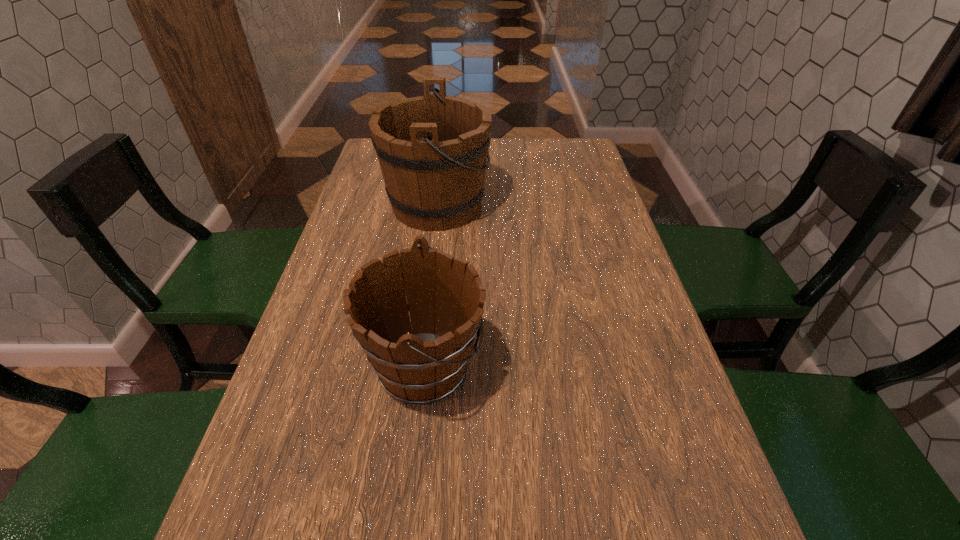
Find the location of a particular element. the taller wine bucket is located at coordinates point(433,149).

Locate an element on the screen. The image size is (960, 540). the taller object is located at coordinates (433, 149).

The height and width of the screenshot is (540, 960). What are the coordinates of `the shorter object` in the screenshot? It's located at (445, 296).

Where is `the shorter wine bucket`? This screenshot has width=960, height=540. the shorter wine bucket is located at coordinates (445, 296).

Where is `free space located 0.230m on the side of the farther wine bucket with the handle for carrying`? The image size is (960, 540). free space located 0.230m on the side of the farther wine bucket with the handle for carrying is located at coordinates (568, 205).

Identify the location of vacant space located 0.150m with the handle on the nearer object. (561, 367).

In the image, there is a desktop. Identify the location of vacant space at the far edge. (532, 148).

Locate an element on the screen. vacant space at the left edge of the desktop is located at coordinates (324, 284).

I want to click on vacant point at the right edge, so click(x=599, y=355).

Identify the location of free space at the far right corner. (571, 156).